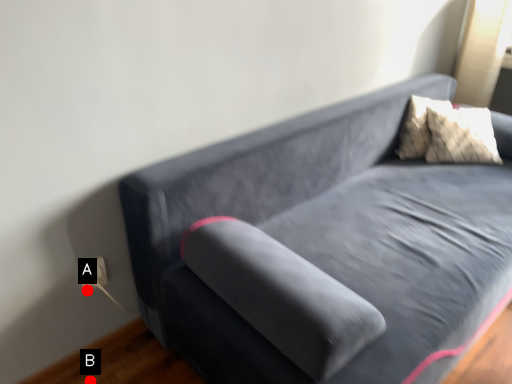
Question: Two points are circled on the image, labeled by A and B beside each circle. Which of the following is the closest to the observer?

Choices:
 (A) A is closer
 (B) B is closer

Answer: (B)